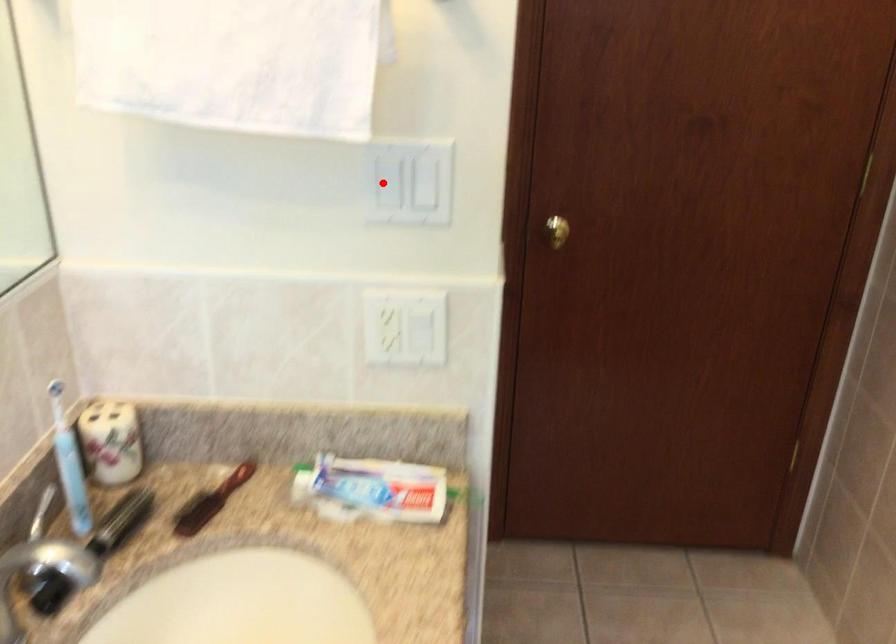
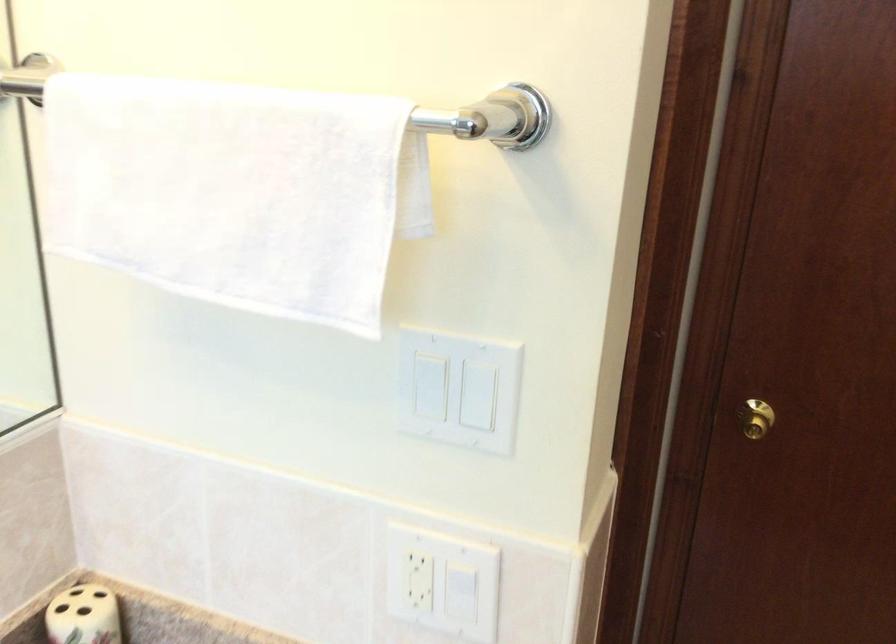
Locate, in the second image, the point that corresponds to the highlighted location in the first image.

(429, 386)